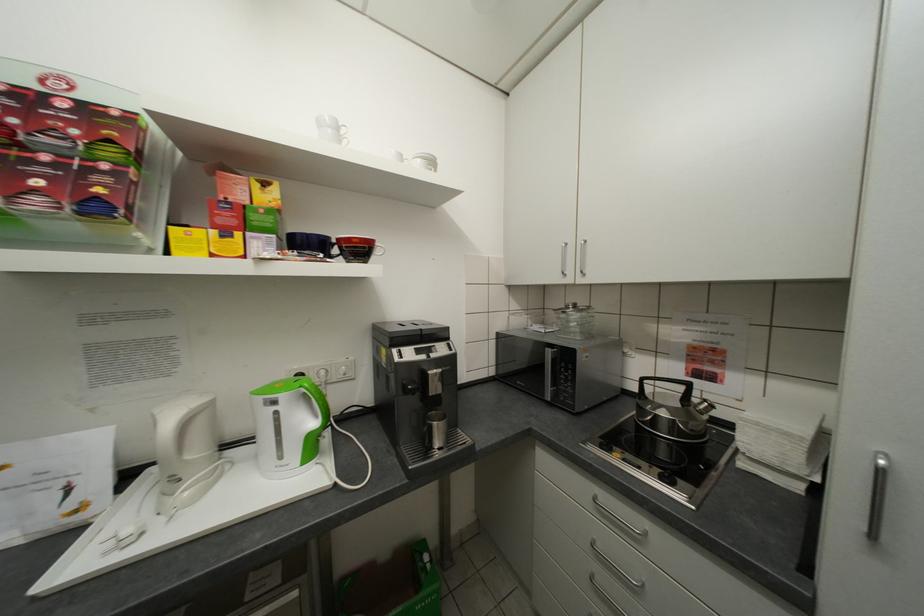
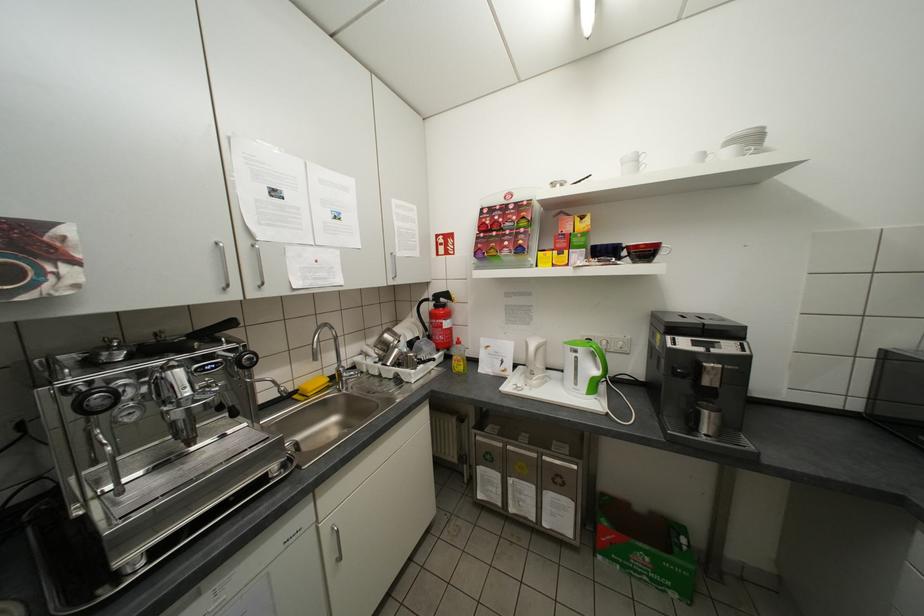
Find the pixel in the second image that matches (430,564) in the first image.

(685, 541)